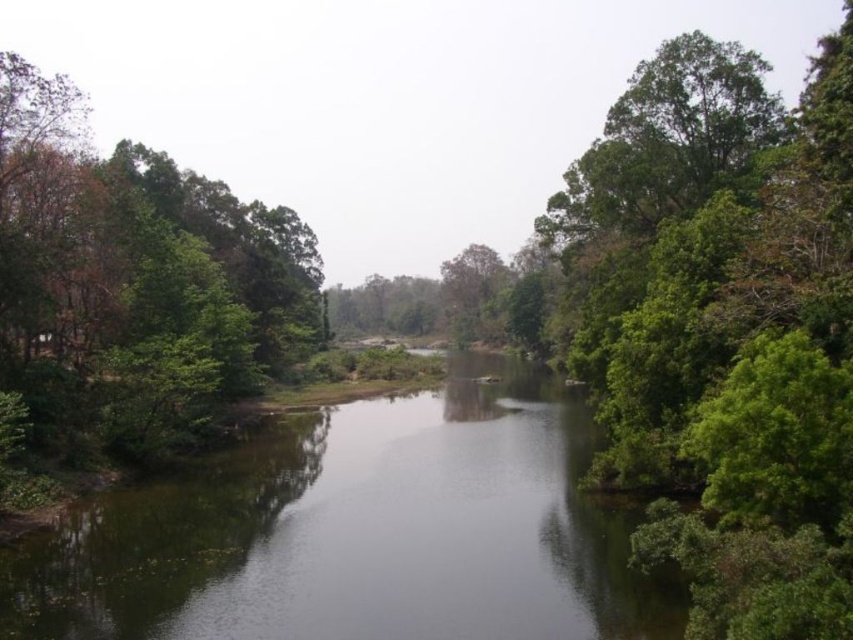
Question: Does green leafy tree at right lie behind green leafy tree at left?

Choices:
 (A) no
 (B) yes

Answer: (A)

Question: Considering the real-world distances, which object is farthest from the green leafy tree at left?

Choices:
 (A) green reflective water at center
 (B) green leafy tree at right

Answer: (B)

Question: Is green leafy tree at right thinner than green reflective water at center?

Choices:
 (A) yes
 (B) no

Answer: (A)

Question: Estimate the real-world distances between objects in this image. Which object is closer to the green leafy tree at left?

Choices:
 (A) green leafy tree at right
 (B) green reflective water at center

Answer: (B)

Question: Among these points, which one is farthest from the camera?

Choices:
 (A) (61, 138)
 (B) (286, 522)
 (C) (798, 448)

Answer: (A)

Question: Does green reflective water at center lie in front of green leafy tree at left?

Choices:
 (A) yes
 (B) no

Answer: (A)